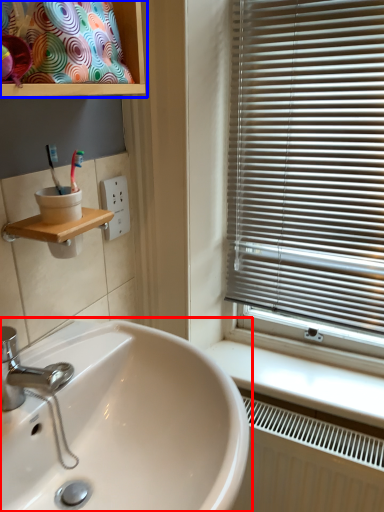
Question: Among these objects, which one is nearest to the camera, sink (highlighted by a red box) or cabinet (highlighted by a blue box)?

Choices:
 (A) sink
 (B) cabinet

Answer: (A)